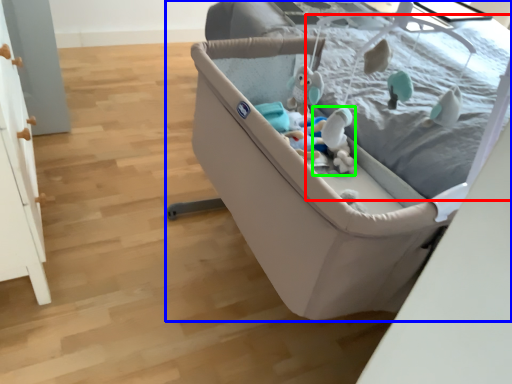
Question: Considering the real-world distances, which object is closest to mattress (highlighted by a red box)? infant bed (highlighted by a blue box) or toy (highlighted by a green box).

Choices:
 (A) infant bed
 (B) toy

Answer: (B)